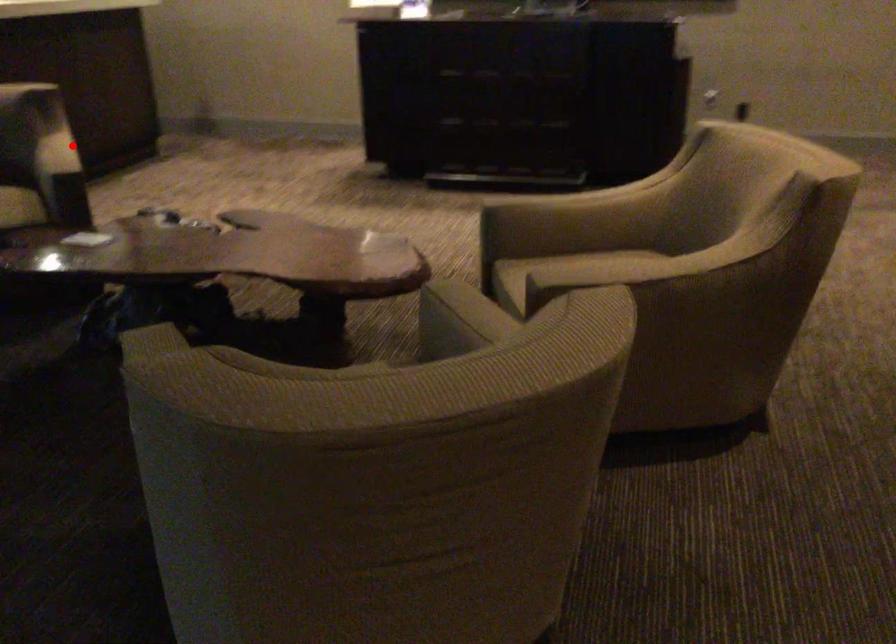
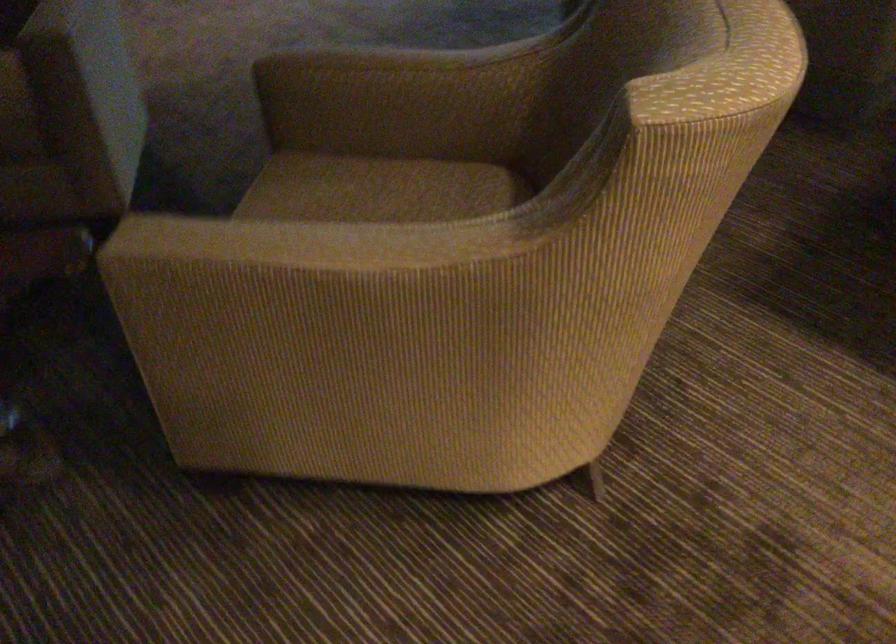
Question: I am providing you with two images of the same scene from different viewpoints. In image1, a red point is highlighted. Considering the same 3D point in image2, which of the following is correct?

Choices:
 (A) It is closer
 (B) It is farther

Answer: (A)